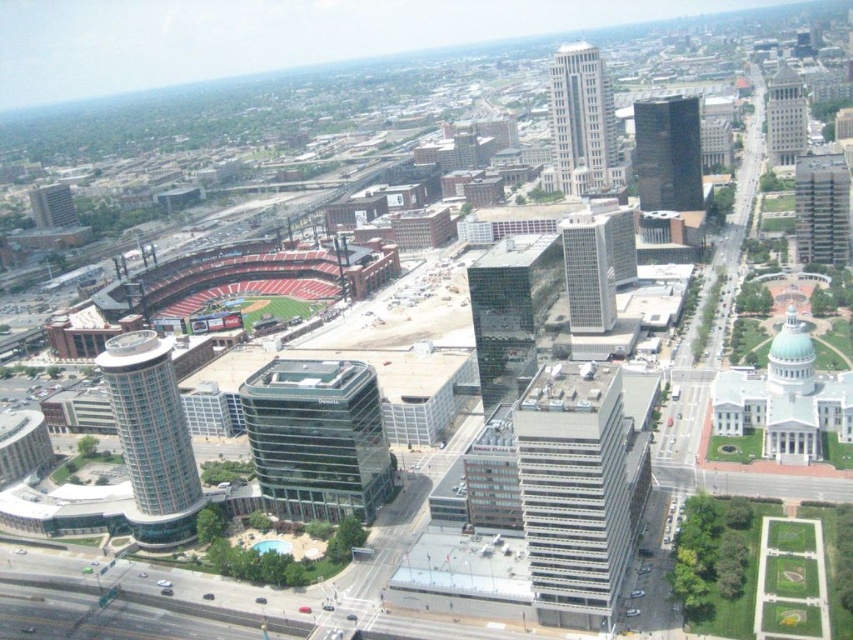
Question: Where is white glass skyscraper at upper center located in relation to gray glass skyscraper at upper right in the image?

Choices:
 (A) above
 (B) below

Answer: (B)

Question: Does white concrete building at center appear over green glass building at center?

Choices:
 (A) no
 (B) yes

Answer: (A)

Question: Which object is farther from the camera taking this photo?

Choices:
 (A) gray glass skyscraper at upper right
 (B) glassy reflective skyscraper at center

Answer: (A)

Question: Which object is positioned closest to the white glass skyscraper at upper center?

Choices:
 (A) glassy reflective skyscraper at center
 (B) gray glass skyscraper at upper right
 (C) matte glass building at upper left

Answer: (B)

Question: Which object is closer to the camera taking this photo?

Choices:
 (A) green glass building at center
 (B) dark glass skyscraper at center-right

Answer: (A)

Question: Is white concrete building at center to the left of glassy silver tower at center-left from the viewer's perspective?

Choices:
 (A) no
 (B) yes

Answer: (A)